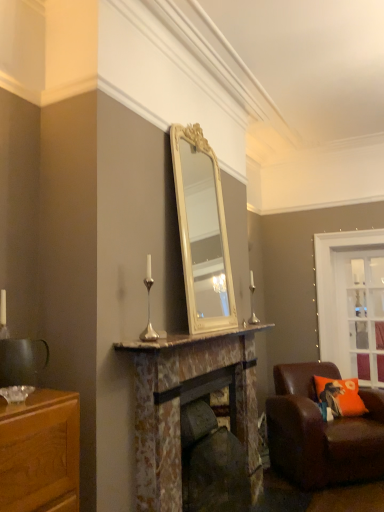
Question: From the image's perspective, is silver metallic candle holder at center, the first candle holder viewed from the front, located beneath clear glass door at upper right?

Choices:
 (A) yes
 (B) no

Answer: (B)

Question: Considering the relative positions of silver metallic candle holder at center, arranged as the 1th candle holder when viewed from the left, and clear glass door at upper right in the image provided, is silver metallic candle holder at center, arranged as the 1th candle holder when viewed from the left, to the left of clear glass door at upper right from the viewer's perspective?

Choices:
 (A) no
 (B) yes

Answer: (B)

Question: Does silver metallic candle holder at center, arranged as the 1th candle holder when viewed from the left, have a lesser width compared to clear glass door at upper right?

Choices:
 (A) yes
 (B) no

Answer: (B)

Question: Is silver metallic candle holder at center, which ranks as the 2th candle holder in right-to-left order, positioned beyond the bounds of clear glass door at upper right?

Choices:
 (A) yes
 (B) no

Answer: (A)

Question: Can you confirm if silver metallic candle holder at center, the 2th candle holder from the back, is bigger than clear glass door at upper right?

Choices:
 (A) yes
 (B) no

Answer: (B)

Question: From the image's perspective, does silver metallic candle holder at center, the 2th candle holder from the back, appear higher than clear glass door at upper right?

Choices:
 (A) no
 (B) yes

Answer: (B)

Question: Considering the relative sizes of silver metallic candle holder at center, the first candle holder viewed from the front, and brown leather chair at lower right in the image provided, is silver metallic candle holder at center, the first candle holder viewed from the front, shorter than brown leather chair at lower right?

Choices:
 (A) no
 (B) yes

Answer: (B)

Question: Is silver metallic candle holder at center, the 2th candle holder from the back, positioned beyond the bounds of brown leather chair at lower right?

Choices:
 (A) yes
 (B) no

Answer: (A)

Question: Is silver metallic candle holder at center, the 2th candle holder from the back, far from brown leather chair at lower right?

Choices:
 (A) yes
 (B) no

Answer: (A)

Question: Can you confirm if silver metallic candle holder at center, arranged as the 1th candle holder when viewed from the left, is taller than brown leather chair at lower right?

Choices:
 (A) yes
 (B) no

Answer: (B)

Question: Is silver metallic candle holder at center, the first candle holder viewed from the front, oriented towards brown leather chair at lower right?

Choices:
 (A) yes
 (B) no

Answer: (B)

Question: Considering the relative sizes of silver metallic candle holder at center, the first candle holder viewed from the front, and brown leather chair at lower right in the image provided, is silver metallic candle holder at center, the first candle holder viewed from the front, smaller than brown leather chair at lower right?

Choices:
 (A) yes
 (B) no

Answer: (A)

Question: Considering the relative sizes of clear glass door at upper right and marble mantel at center in the image provided, is clear glass door at upper right smaller than marble mantel at center?

Choices:
 (A) no
 (B) yes

Answer: (A)